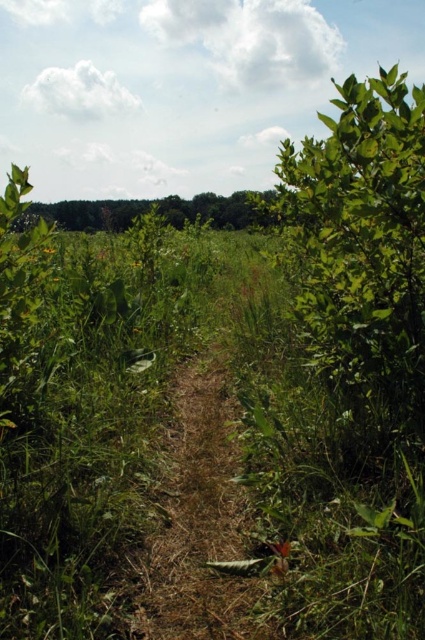
Question: Can you confirm if brown grassy dirt track at center is positioned below green leafy tree at upper center?

Choices:
 (A) no
 (B) yes

Answer: (B)

Question: Which object is farther from the camera taking this photo?

Choices:
 (A) green leafy tree at upper center
 (B) brown grassy dirt track at center

Answer: (A)

Question: Which point is closer to the camera taking this photo?

Choices:
 (A) (186, 385)
 (B) (91, 209)

Answer: (A)

Question: Considering the relative positions of brown grassy dirt track at center and green leafy tree at upper center in the image provided, where is brown grassy dirt track at center located with respect to green leafy tree at upper center?

Choices:
 (A) above
 (B) below

Answer: (B)

Question: In this image, where is brown grassy dirt track at center located relative to green leafy tree at upper center?

Choices:
 (A) above
 (B) below

Answer: (B)

Question: Which point is farther to the camera?

Choices:
 (A) brown grassy dirt track at center
 (B) green leafy tree at upper center

Answer: (B)